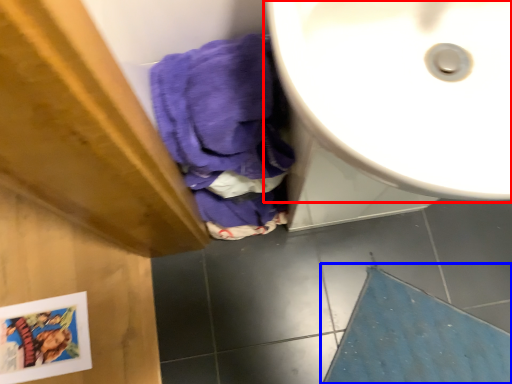
Question: Which object is further to the camera taking this photo, sink (highlighted by a red box) or bath mat (highlighted by a blue box)?

Choices:
 (A) sink
 (B) bath mat

Answer: (B)